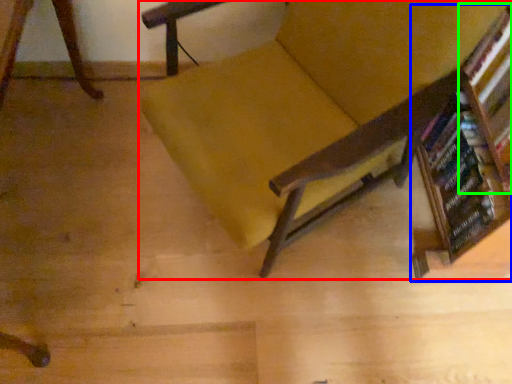
Question: Estimate the real-world distances between objects in this image. Which object is closer to chair (highlighted by a red box), bookcase (highlighted by a blue box) or shelf (highlighted by a green box)?

Choices:
 (A) bookcase
 (B) shelf

Answer: (A)